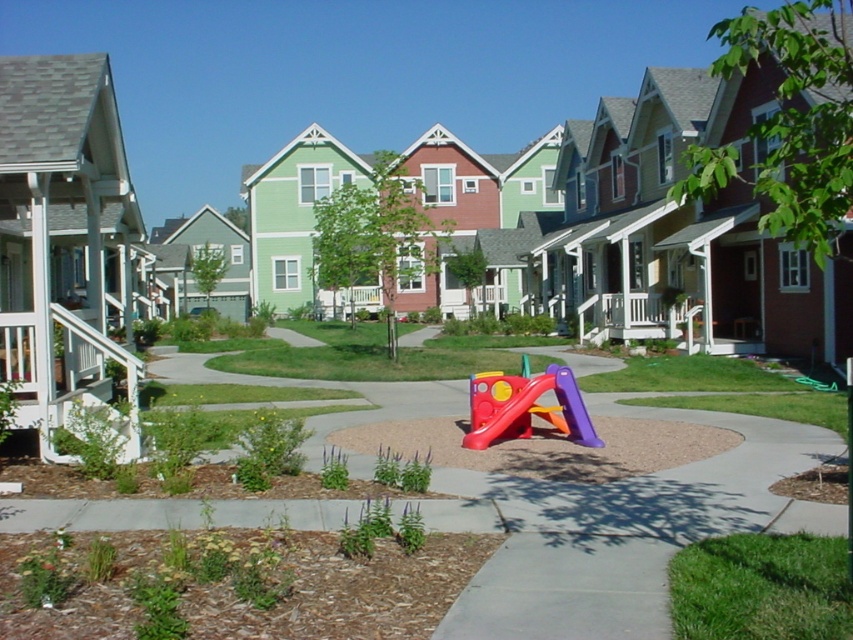
Question: Can you confirm if rubberized plastic slide at center is positioned below white painted wood porch at lower left?

Choices:
 (A) no
 (B) yes

Answer: (B)

Question: Considering the relative positions of rubberized plastic slide at center and white painted wood porch at lower left in the image provided, where is rubberized plastic slide at center located with respect to white painted wood porch at lower left?

Choices:
 (A) right
 (B) left

Answer: (A)

Question: Can you confirm if rubberized plastic slide at center is positioned above white painted wood porch at lower left?

Choices:
 (A) no
 (B) yes

Answer: (A)

Question: Which point appears farthest from the camera in this image?

Choices:
 (A) (492, 401)
 (B) (120, 435)

Answer: (A)